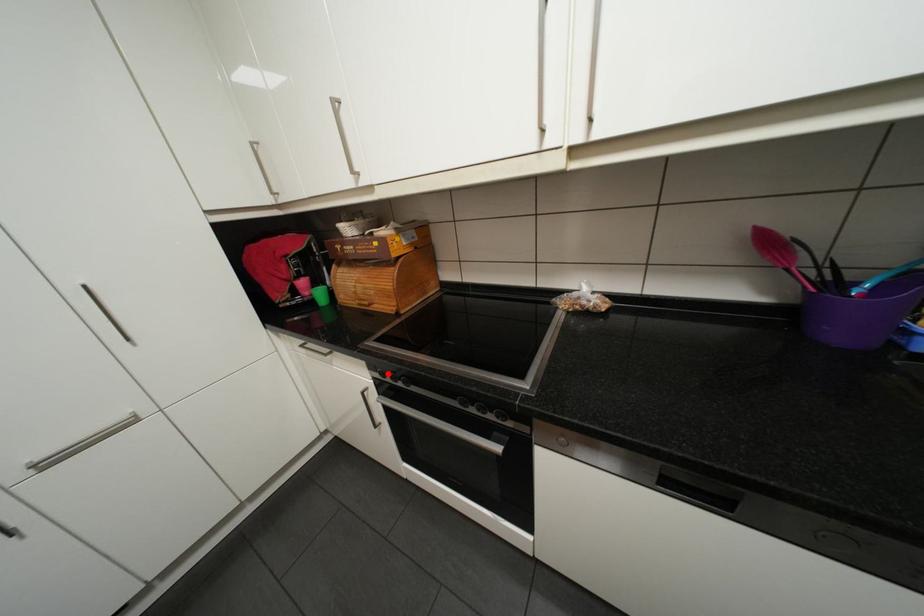
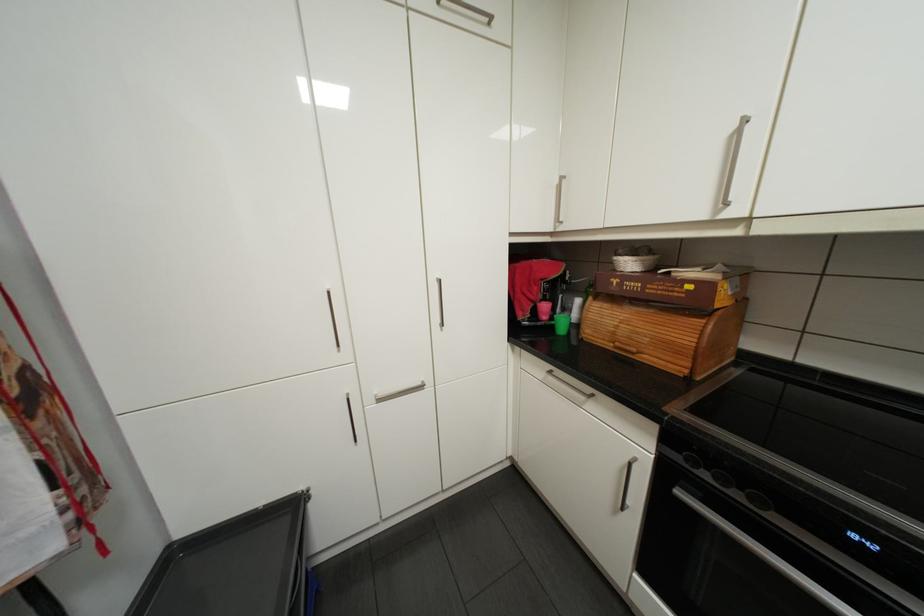
Question: I am providing you with two images of the same scene from different viewpoints. A red point is marked on the first image. At the location where the point appears in image 1, is it still visible in image 2?

Choices:
 (A) Yes
 (B) No

Answer: (A)